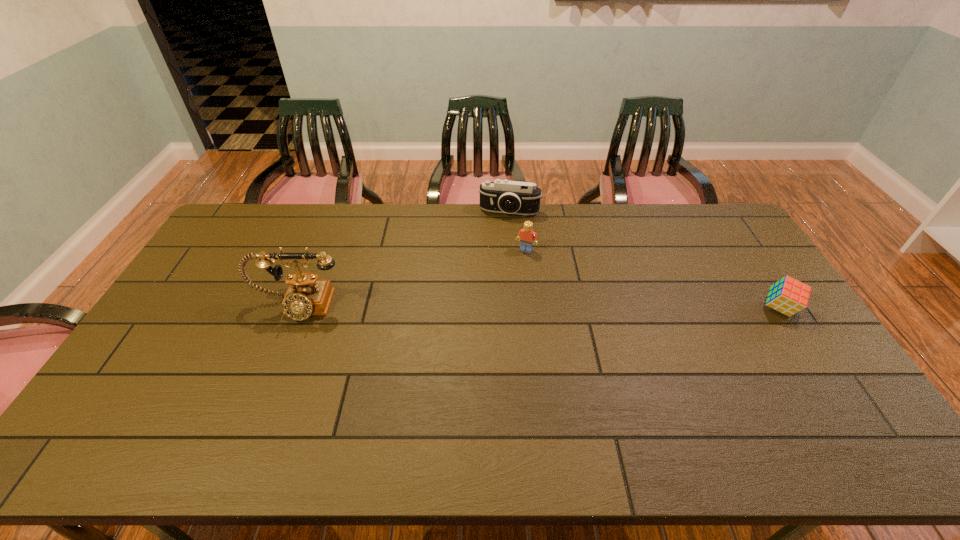
This screenshot has height=540, width=960. I want to click on free space between the camera and the Lego, so click(x=517, y=231).

Find the location of a particular element. The height and width of the screenshot is (540, 960). unoccupied position between the second farthest object and the rightmost object is located at coordinates (653, 279).

At what (x,y) coordinates should I click in order to perform the action: click on the second closest object to the cube. Please return your answer as a coordinate pair (x, y). This screenshot has height=540, width=960. Looking at the image, I should click on (501, 196).

You are a GUI agent. You are given a task and a screenshot of the screen. Output one action in this format:
    pyautogui.click(x=<x>, y=<y>)
    Task: Click on the third closest object relative to the Lego
    The image size is (960, 540).
    Given the screenshot: What is the action you would take?
    pyautogui.click(x=788, y=296)

The height and width of the screenshot is (540, 960). Find the location of `vacant area that satisfies the following two spatial constraints: 1. on the front side of the Lego; 2. on the right side of the rightmost object`. vacant area that satisfies the following two spatial constraints: 1. on the front side of the Lego; 2. on the right side of the rightmost object is located at coordinates (533, 308).